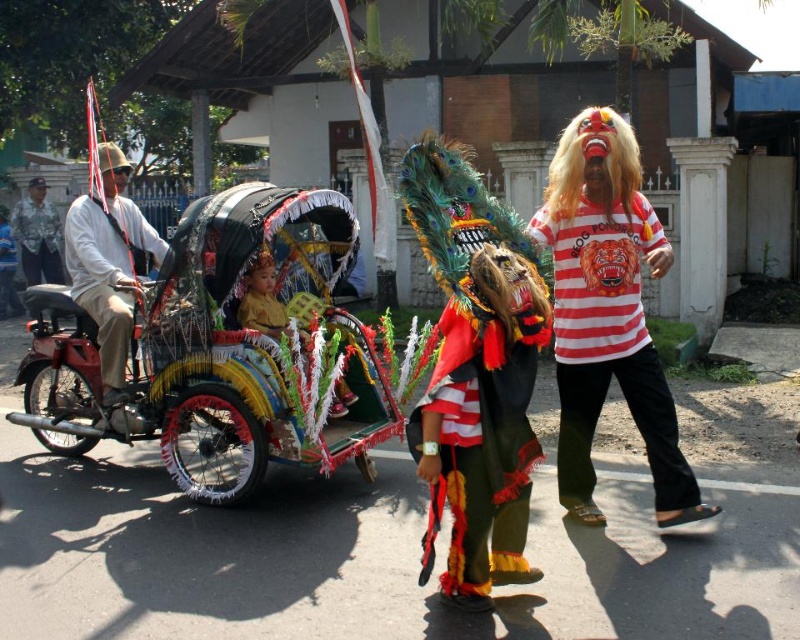
Which is more to the right, light brown leather jacket at left or brushed metal helmet at left?

light brown leather jacket at left

Where is `light brown leather jacket at left`? Image resolution: width=800 pixels, height=640 pixels. light brown leather jacket at left is located at coordinates (110, 272).

Is red and black fabric dragon at center taller than brushed metal helmet at left?

No, red and black fabric dragon at center is not taller than brushed metal helmet at left.

Is red and black fabric dragon at center thinner than brushed metal helmet at left?

Correct, red and black fabric dragon at center's width is less than brushed metal helmet at left's.

The width and height of the screenshot is (800, 640). What do you see at coordinates (480, 449) in the screenshot? I see `red and black fabric dragon at center` at bounding box center [480, 449].

Locate an element on the screen. The image size is (800, 640). red and black fabric dragon at center is located at coordinates (480, 449).

Does decorative painted cart at center appear under light brown leather jacket at left?

Correct, decorative painted cart at center is located below light brown leather jacket at left.

Who is higher up, decorative painted cart at center or light brown leather jacket at left?

Positioned higher is light brown leather jacket at left.

Does point (256, 198) come farther from viewer compared to point (92, 294)?

That is False.

Locate an element on the screen. The width and height of the screenshot is (800, 640). decorative painted cart at center is located at coordinates (216, 349).